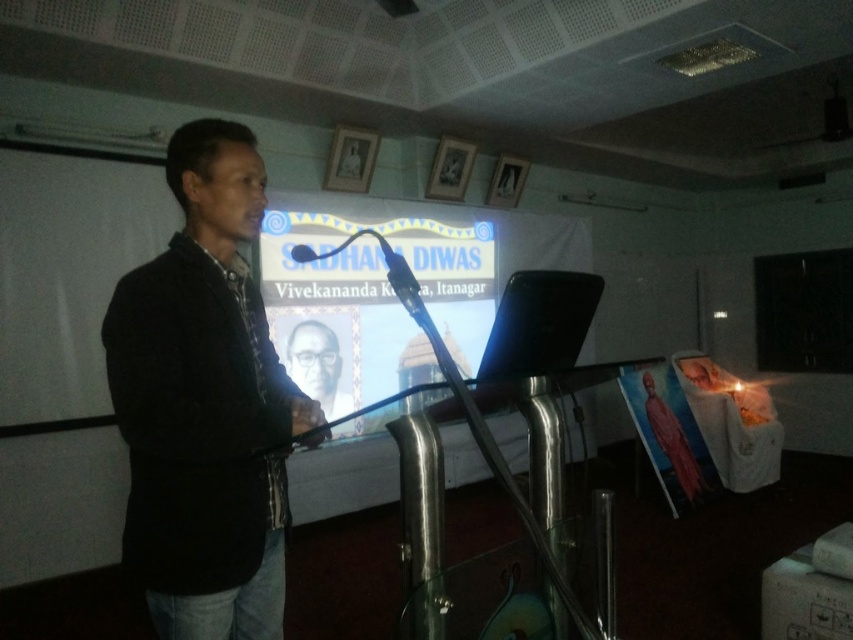
You are setting up a camera to capture both the speaker and the presentation. The camera is placed at the back of the room. Which object, the matte black screen at center or the matte black microphone at center, will appear taller in the camera view?

The matte black screen at center has a greater height compared to the matte black microphone at center, so it will appear taller in the camera view.

You are setting up a projector for a presentation. The matte black screen at center and the matte black portrait at center are both on the projection surface. If the projector can only focus on objects within a 10 inch range, will both objects be in focus?

The matte black screen at center and matte black portrait at center are 15.70 inches apart, so they are outside the projector focus range of 10 inches. Therefore, both objects cannot be in focus simultaneously.

You are organizing an event and need to place a decorative banner between the matte black screen at center and the matte black microphone at center. Since the banner must be placed in front of the larger object, which object should the banner be placed in front of?

The matte black screen at center is larger in size than the matte black microphone at center, so the banner should be placed in front of the matte black screen at center.